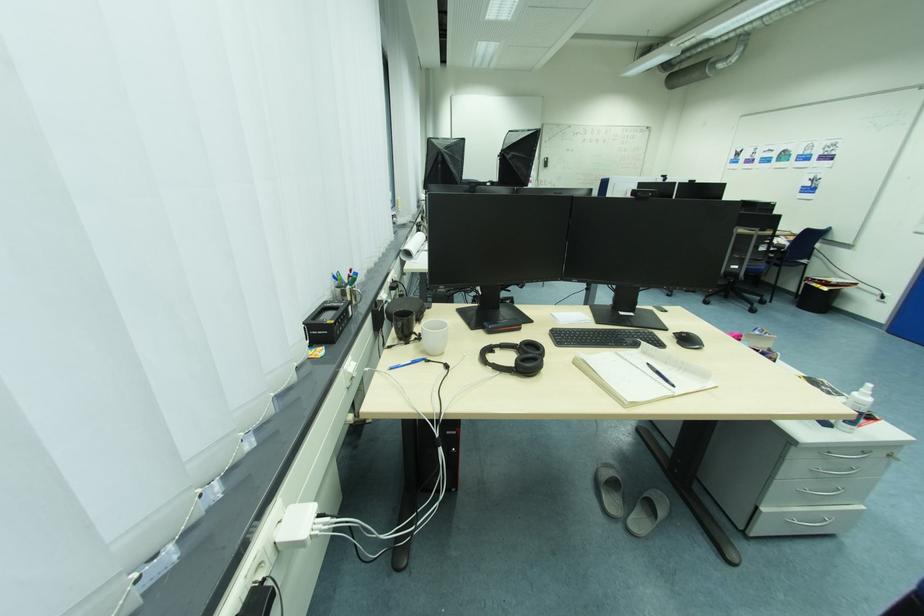
The image size is (924, 616). Describe the element at coordinates (777, 240) in the screenshot. I see `the chair armrest` at that location.